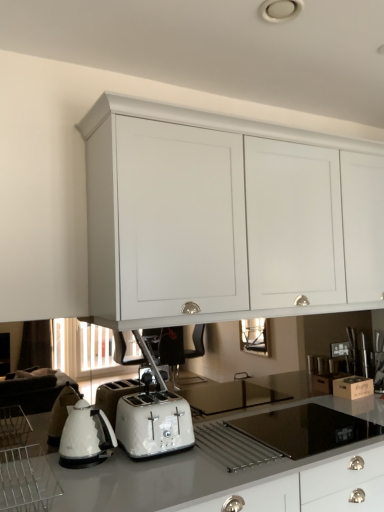
Question: Considering the positions of white glossy toaster at lower center and clear plastic rack at lower left in the image, is white glossy toaster at lower center wider or thinner than clear plastic rack at lower left?

Choices:
 (A) wide
 (B) thin

Answer: (B)

Question: Is point (137, 440) closer or farther from the camera than point (14, 490)?

Choices:
 (A) closer
 (B) farther

Answer: (B)

Question: Estimate the real-world distances between objects in this image. Which object is farther from the clear plastic rack at lower left?

Choices:
 (A) black glass gas stove at center
 (B) white glossy kettle at lower left
 (C) white matte cabinet at upper center
 (D) white glossy countertop at lower center
 (E) white glossy toaster at lower center

Answer: (C)

Question: Estimate the real-world distances between objects in this image. Which object is closer to the white glossy toaster at lower center?

Choices:
 (A) white glossy countertop at lower center
 (B) black glass gas stove at center
 (C) clear plastic rack at lower left
 (D) white matte cabinet at upper center
 (E) white glossy kettle at lower left

Answer: (E)